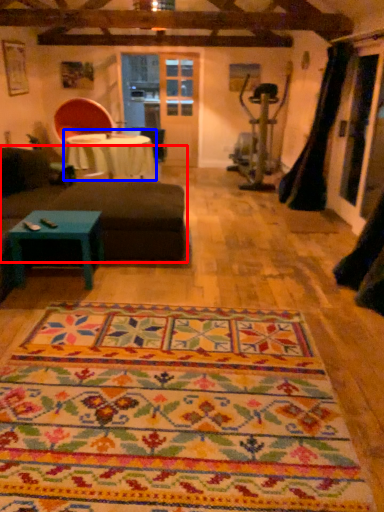
Question: Which of the following is the farthest to the observer, studio couch (highlighted by a red box) or table (highlighted by a blue box)?

Choices:
 (A) studio couch
 (B) table

Answer: (B)